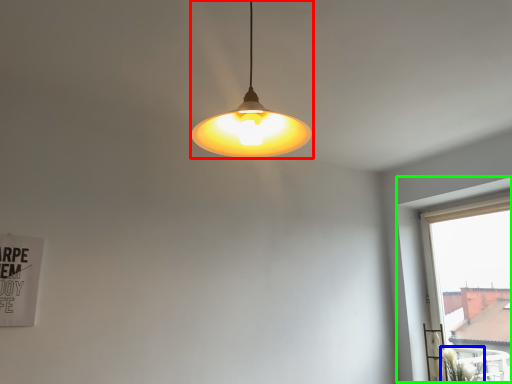
Question: Which is nearer to the lamp (highlighted by a red box)? plant (highlighted by a blue box) or window (highlighted by a green box).

Choices:
 (A) plant
 (B) window

Answer: (B)